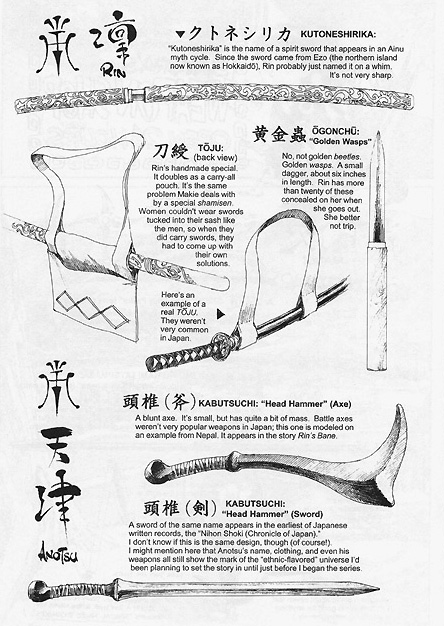
I want to click on ornamental sword handle, so click(81, 95).